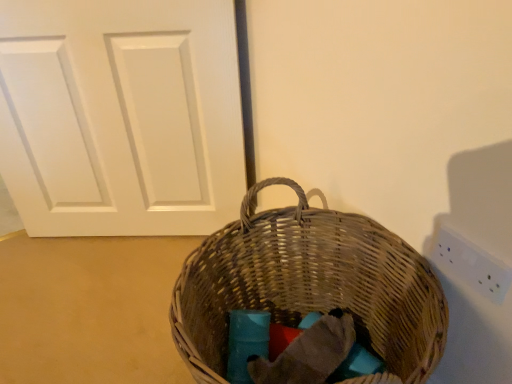
Question: Can you confirm if white matte door at center is shorter than white plastic electric outlet at upper right?

Choices:
 (A) no
 (B) yes

Answer: (A)

Question: Considering the relative sizes of white matte door at center and white plastic electric outlet at upper right in the image provided, is white matte door at center bigger than white plastic electric outlet at upper right?

Choices:
 (A) yes
 (B) no

Answer: (A)

Question: Is white matte door at center outside white plastic electric outlet at upper right?

Choices:
 (A) yes
 (B) no

Answer: (A)

Question: From a real-world perspective, is white matte door at center on top of white plastic electric outlet at upper right?

Choices:
 (A) yes
 (B) no

Answer: (B)

Question: Considering the relative sizes of white matte door at center and white plastic electric outlet at upper right in the image provided, is white matte door at center wider than white plastic electric outlet at upper right?

Choices:
 (A) yes
 (B) no

Answer: (A)

Question: Is white matte door at center inside or outside of woven brown picnic basket at center?

Choices:
 (A) outside
 (B) inside

Answer: (A)

Question: Visually, is white matte door at center positioned to the left or to the right of woven brown picnic basket at center?

Choices:
 (A) left
 (B) right

Answer: (A)

Question: In terms of height, does white matte door at center look taller or shorter compared to woven brown picnic basket at center?

Choices:
 (A) tall
 (B) short

Answer: (A)

Question: Is point tap(31, 1) closer or farther from the camera than point tap(343, 244)?

Choices:
 (A) closer
 (B) farther

Answer: (B)

Question: From the image's perspective, is woven brown picnic basket at center located above or below white plastic electric outlet at upper right?

Choices:
 (A) above
 (B) below

Answer: (B)

Question: Is woven brown picnic basket at center taller or shorter than white plastic electric outlet at upper right?

Choices:
 (A) tall
 (B) short

Answer: (A)

Question: In terms of width, does woven brown picnic basket at center look wider or thinner when compared to white plastic electric outlet at upper right?

Choices:
 (A) wide
 (B) thin

Answer: (A)

Question: Would you say woven brown picnic basket at center is to the left or to the right of white plastic electric outlet at upper right in the picture?

Choices:
 (A) left
 (B) right

Answer: (A)

Question: From a real-world perspective, relative to woven brown picnic basket at center, is white plastic electric outlet at upper right vertically above or below?

Choices:
 (A) above
 (B) below

Answer: (A)

Question: From the image's perspective, is white plastic electric outlet at upper right located above or below woven brown picnic basket at center?

Choices:
 (A) below
 (B) above

Answer: (B)